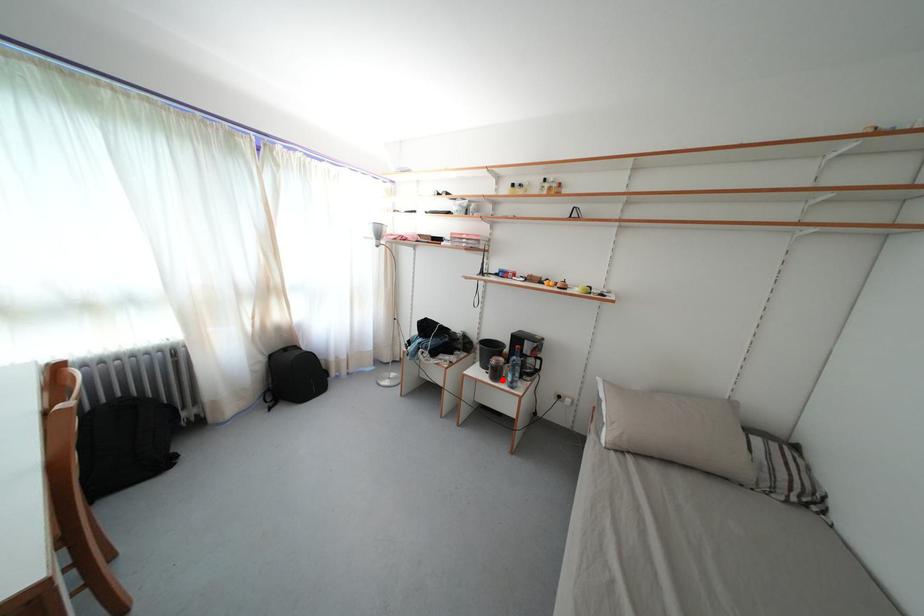
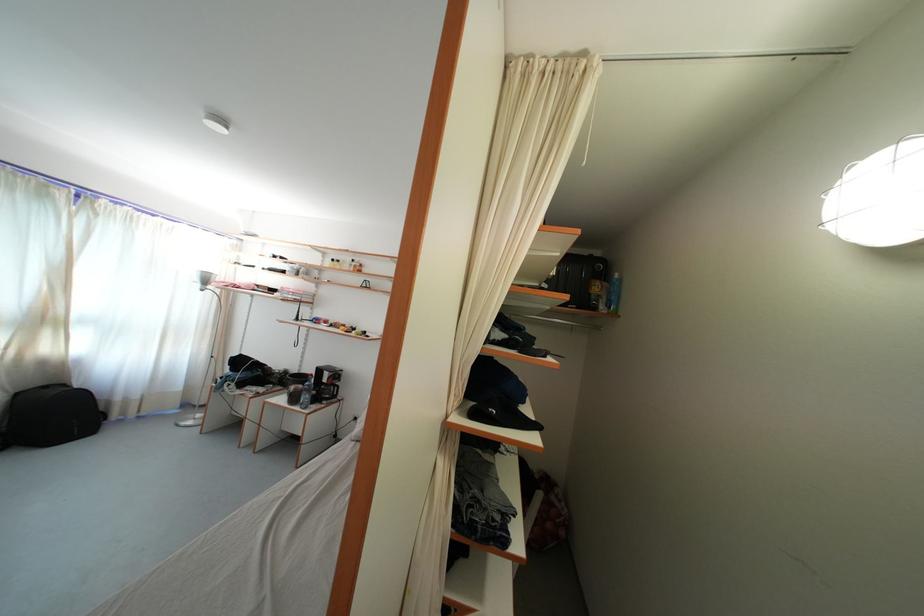
Find the pixel in the second image that matches the highlighted location in the first image.

(300, 405)